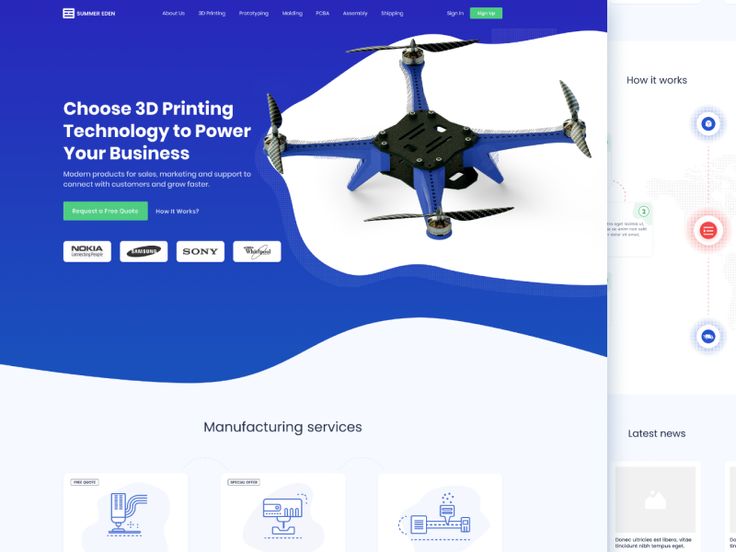
Identify the location of stand. (484, 163).